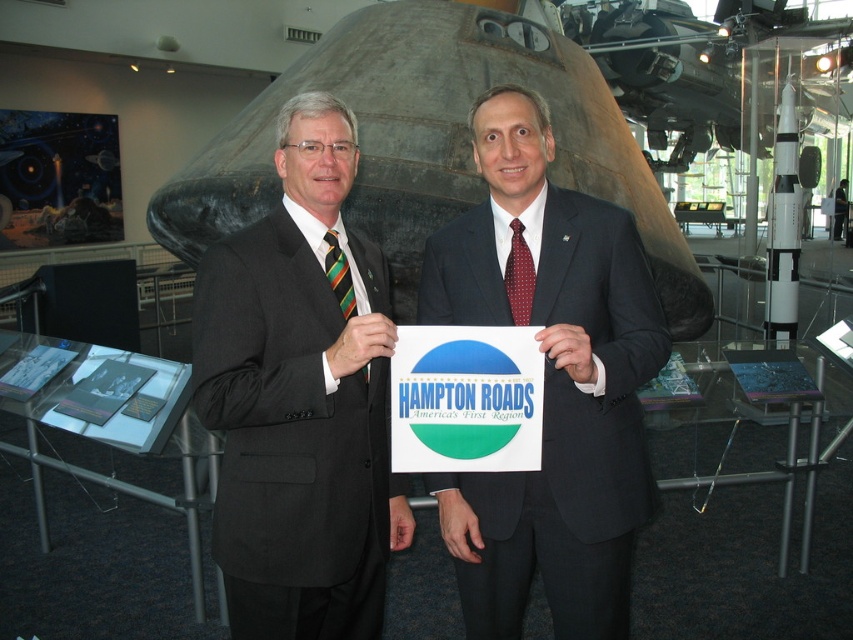
You are an event planner organizing a photoshoot in the museum. You need to position a camera to capture both the black suit at center and the red dotted silk tie at center clearly. Considering their widths, which object should you focus on first to ensure proper framing?

The black suit at center is wider than the red dotted silk tie at center, so you should focus on the black suit at center first to ensure proper framing.

You are organizing an event and need to place a 3D model of a satellite that requires 2 meters of space. You see the black suit at center and the shiny metallic rocket at center. Which object can accommodate the satellite model?

The shiny metallic rocket at center occupies more space than the black suit at center, so the satellite model can be placed near the shiny metallic rocket at center as it has enough space.